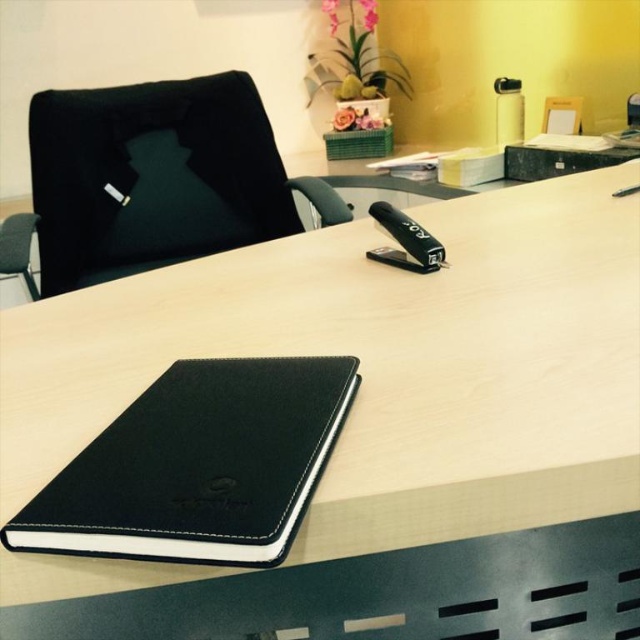
Between point (204, 419) and point (246, 198), which one is positioned behind?

The point (246, 198) is behind.

Can you confirm if black leather notebook at lower left is shorter than black leather swivel chair at left?

Yes, black leather notebook at lower left is shorter than black leather swivel chair at left.

In order to click on black leather notebook at lower left in this screenshot , I will do `click(198, 465)`.